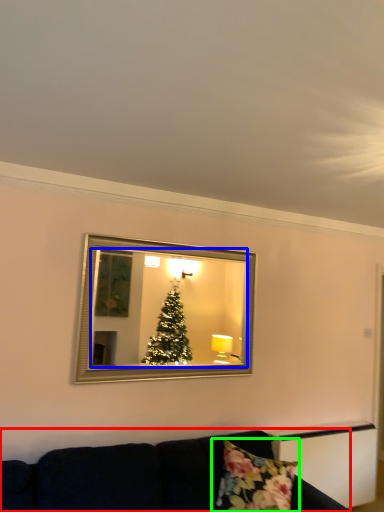
Question: Which object is the farthest from studio couch (highlighted by a red box)? Choose among these: mirror (highlighted by a blue box) or pillow (highlighted by a green box).

Choices:
 (A) mirror
 (B) pillow

Answer: (A)